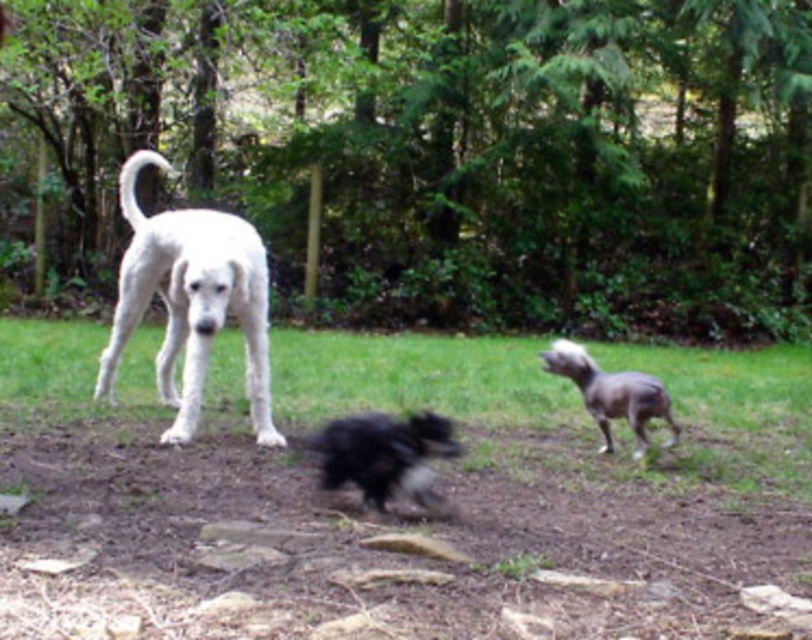
Question: Can you confirm if white fur dog at left is positioned above shaggy black dog at center?

Choices:
 (A) yes
 (B) no

Answer: (A)

Question: Does white fur dog at left appear on the right side of silky gray dog at center?

Choices:
 (A) yes
 (B) no

Answer: (B)

Question: Which of the following is the closest to the observer?

Choices:
 (A) (365, 493)
 (B) (549, 349)

Answer: (A)

Question: Is brown dirt field at center to the right of white fur dog at left from the viewer's perspective?

Choices:
 (A) yes
 (B) no

Answer: (A)

Question: Which object appears closest to the camera in this image?

Choices:
 (A) silky gray dog at center
 (B) shaggy black dog at center
 (C) white fur dog at left
 (D) brown dirt field at center

Answer: (D)

Question: Among these points, which one is nearest to the camera?

Choices:
 (A) (219, 317)
 (B) (590, 403)
 (C) (385, 464)

Answer: (C)